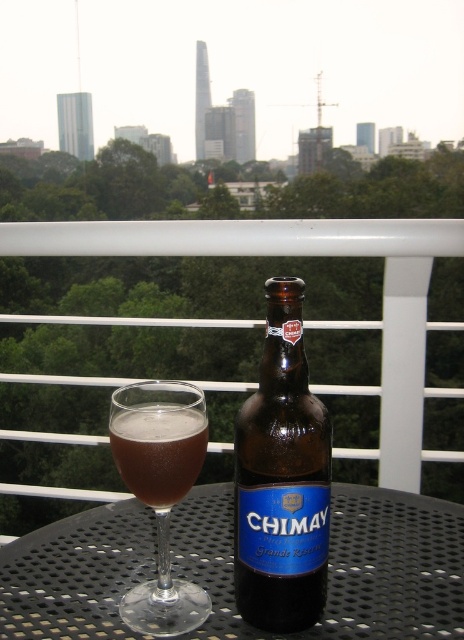
You are standing on the balcony and want to place a small potted plant between the black metal table at center and the brown glass at center. Based on their positions, which object should the plant be closer to?

The plant should be placed closer to the brown glass at center because the black metal table at center is positioned to the right of the brown glass at center.

You are a guest at a party on the balcony and want to place a small plate on the black metal table at center. However, there is a transparent glass at center above it. Can you place the plate on the table without it being under the glass?

The black metal table at center is positioned under the transparent glass at center, so placing the plate on the table would mean it is under the glass. Therefore, you cannot place the plate there without it being under the glass.